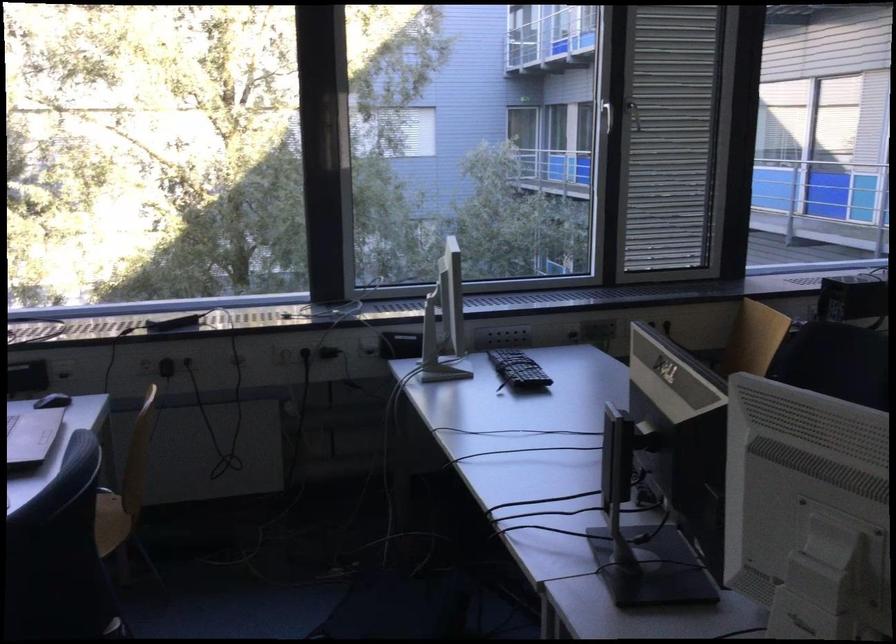
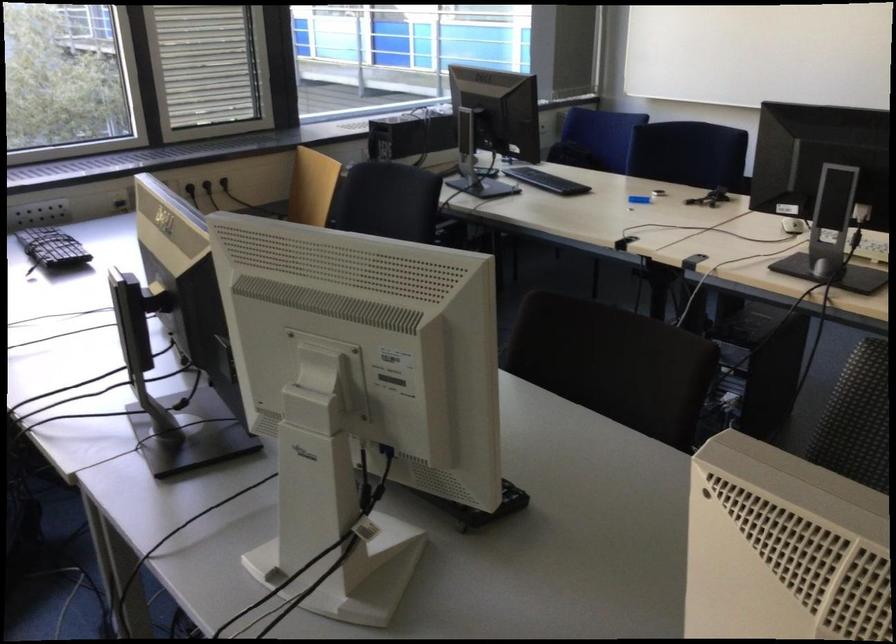
Question: The camera is either moving clockwise (left) or counter-clockwise (right) around the object. The first image is from the beginning of the video and the second image is from the end. Is the camera moving left or right when shooting the video?

Choices:
 (A) Left
 (B) Right

Answer: (A)